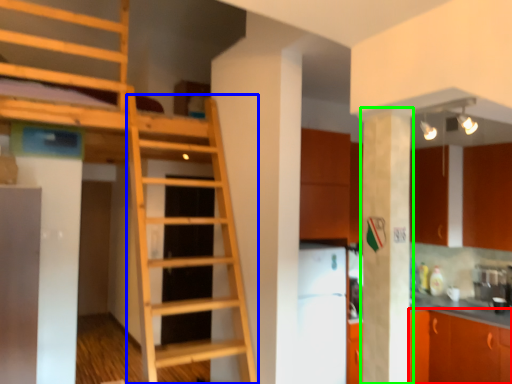
Question: Estimate the real-world distances between objects in this image. Which object is closer to cabinetry (highlighted by a red box), ladder (highlighted by a blue box) or pillar (highlighted by a green box)?

Choices:
 (A) ladder
 (B) pillar

Answer: (B)